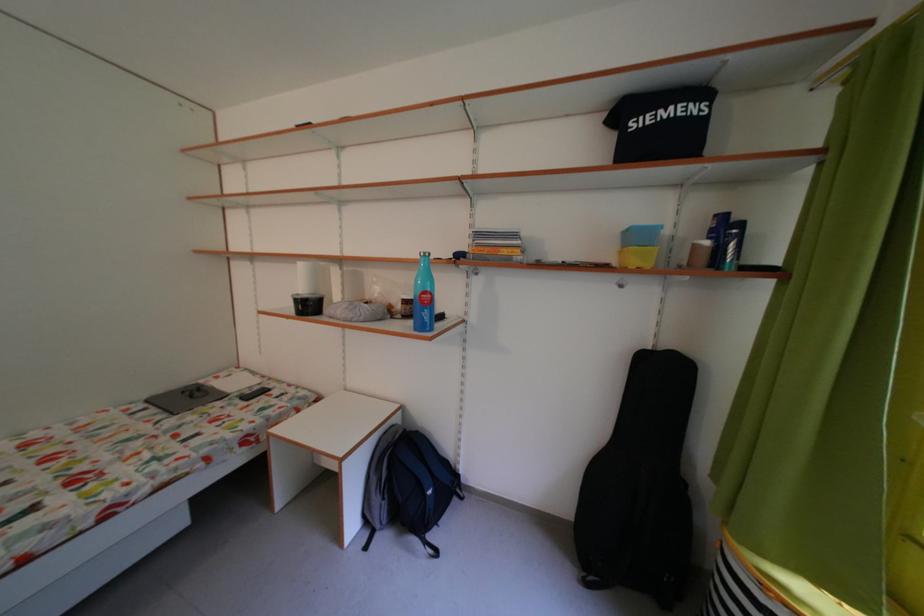
Identify the location of grey laptop. The image size is (924, 616). click(186, 398).